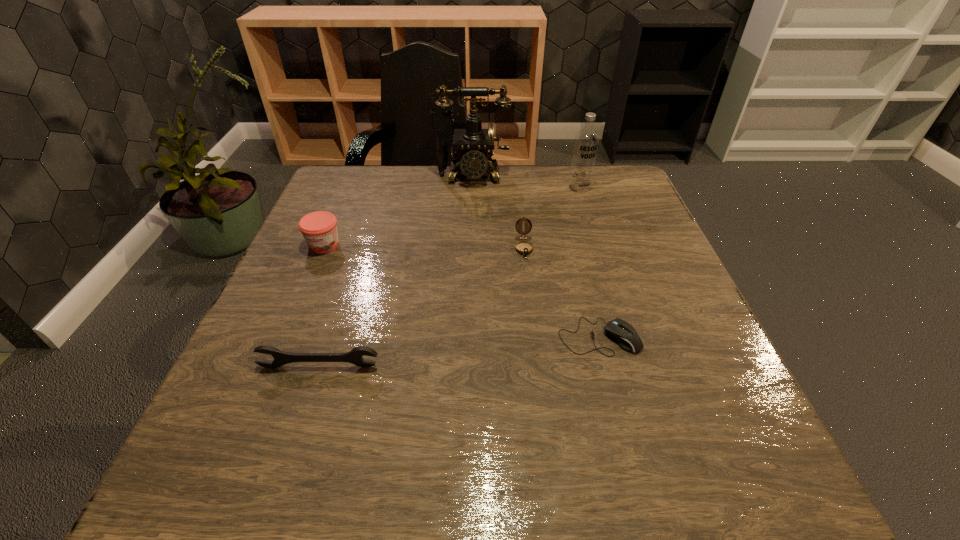
Where is `telephone`? The image size is (960, 540). telephone is located at coordinates (471, 145).

You are a GUI agent. You are given a task and a screenshot of the screen. Output one action in this format:
    pyautogui.click(x=<x>, y=<y>)
    Task: Click on the fifth shortest object
    Image resolution: width=960 pixels, height=540 pixels.
    Given the screenshot: What is the action you would take?
    pyautogui.click(x=586, y=141)

The image size is (960, 540). In order to click on the third tallest object in this screenshot , I will do `click(319, 229)`.

Locate an element on the screen. compass is located at coordinates (524, 248).

At what (x,y) coordinates should I click in order to perform the action: click on wrench. Please return your answer as a coordinate pair (x, y). Looking at the image, I should click on (354, 356).

Identify the location of computer mouse. The height and width of the screenshot is (540, 960). (622, 332).

Find the location of a particular element. The height and width of the screenshot is (540, 960). the second nearest object is located at coordinates (622, 332).

This screenshot has height=540, width=960. What are the coordinates of `free space located on the rotary dial of the tallest object` in the screenshot? It's located at (470, 217).

Locate an element on the screen. vacant point located on the front label of the vodka is located at coordinates (585, 206).

The image size is (960, 540). What are the coordinates of `vacant space located 0.400m on the front label of the jam` in the screenshot? It's located at (247, 426).